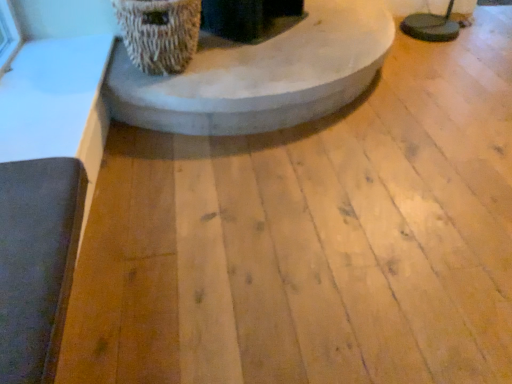
What do you see at coordinates (260, 74) in the screenshot? The width and height of the screenshot is (512, 384). I see `white concrete fireplace at upper center` at bounding box center [260, 74].

I want to click on white concrete fireplace at upper center, so click(x=260, y=74).

The height and width of the screenshot is (384, 512). Find the location of `white concrete fireplace at upper center`. white concrete fireplace at upper center is located at coordinates (260, 74).